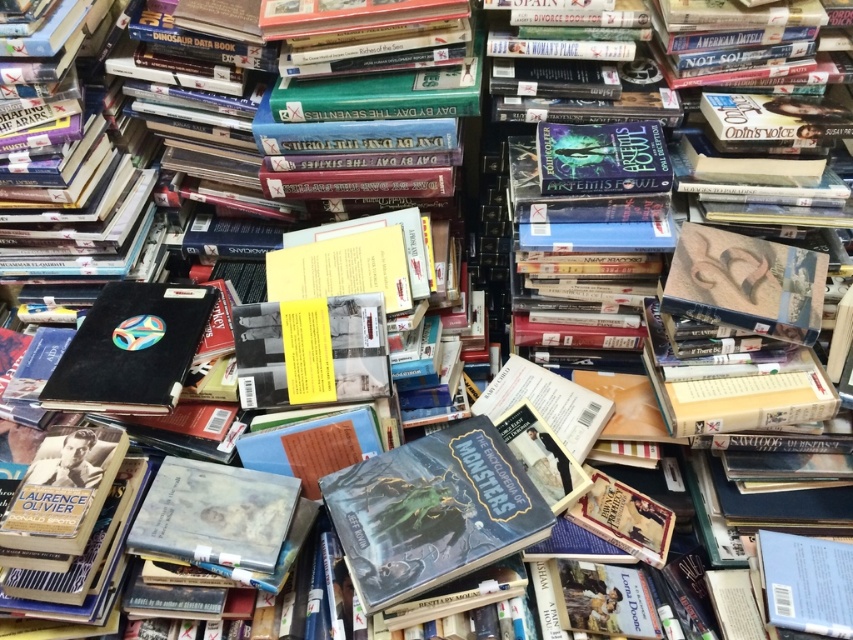
You are a librarian organizing books. You have a shelf that can only hold books up to the size of the black matte book at center. Can the hardcover book at center fit on this shelf?

The hardcover book at center is larger in size than the black matte book at center, so it cannot fit on the shelf designed for the smaller size.

You are a delivery person who needs to place a new book that is 18 inches long between the hardcover book at center and the black matte book at center. Can you fit the new book between them without moving the existing books?

The hardcover book at center and the black matte book at center are 19.02 inches apart from each other. Since the new book is 18 inches long, it can fit between them as there is enough space.